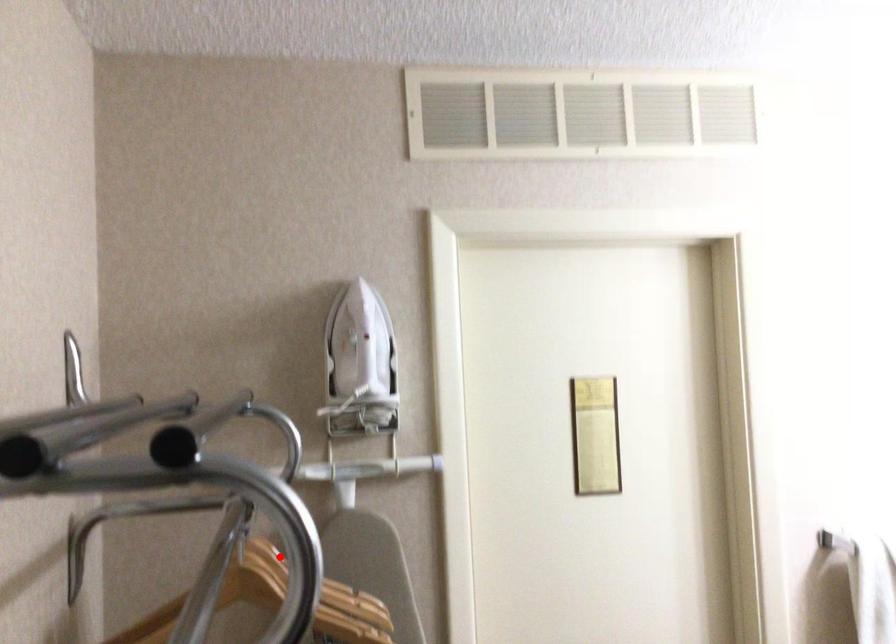
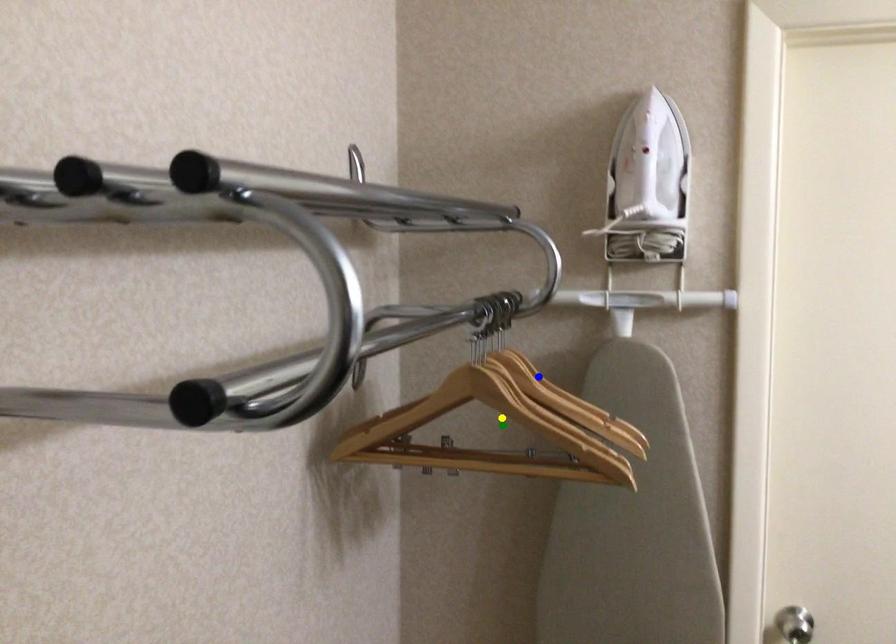
Question: I am providing you with two images of the same scene from different viewpoints. A red point is marked on the first image. You are given multiple points on the second image. Which spot in image 2 lines up with the point in image 1?

Choices:
 (A) yellow point
 (B) green point
 (C) blue point

Answer: (C)